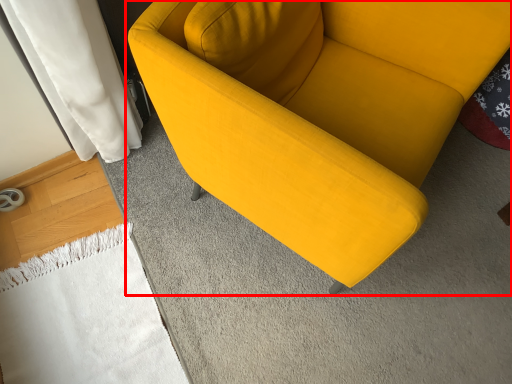
Question: In this image, where is studio couch (annotated by the red box) located relative to blanket?

Choices:
 (A) left
 (B) right

Answer: (B)